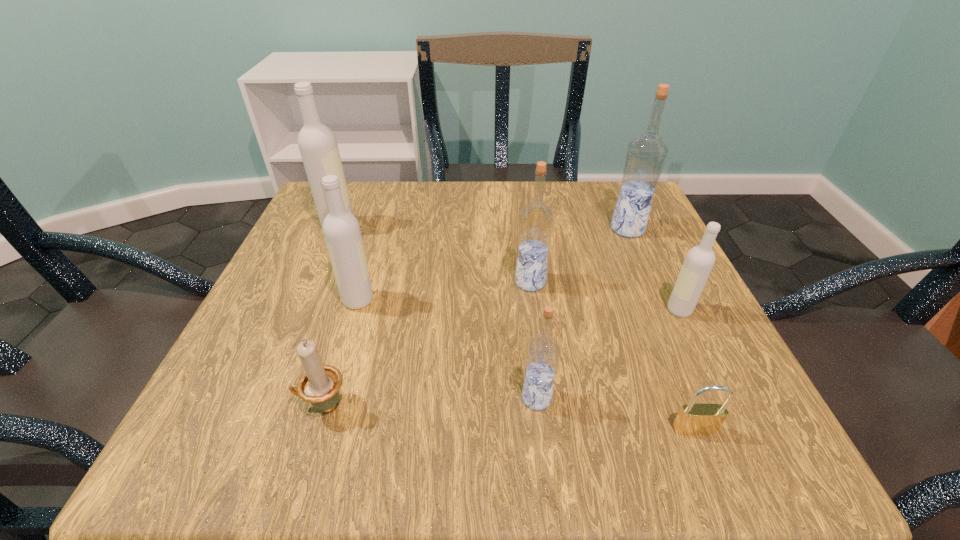
At what (x,y) coordinates should I click in order to perform the action: click on candle_holder. Please return your answer as a coordinate pair (x, y). Looking at the image, I should click on pos(320,384).

Locate an element on the screen. The height and width of the screenshot is (540, 960). brass padlock is located at coordinates (693, 419).

Image resolution: width=960 pixels, height=540 pixels. In order to click on padlock in this screenshot , I will do `click(693, 419)`.

The width and height of the screenshot is (960, 540). I want to click on vacant area located 0.150m on the back of the farthest white vodka, so coord(356,184).

I want to click on free space located on the left of the farthest blue vodka, so [x=508, y=229].

I want to click on vacant area situated 0.210m on the right of the second white vodka from right to left, so click(492, 300).

The height and width of the screenshot is (540, 960). Find the location of `vacant area located 0.110m on the left of the second nearest blue vodka`. vacant area located 0.110m on the left of the second nearest blue vodka is located at coordinates (455, 282).

At what (x,y) coordinates should I click in order to perform the action: click on vacant point located 0.070m on the front of the smallest white vodka. Please return your answer as a coordinate pair (x, y). Image resolution: width=960 pixels, height=540 pixels. Looking at the image, I should click on 699,352.

At what (x,y) coordinates should I click in order to perform the action: click on free space located on the left of the nearest blue vodka. Please return your answer as a coordinate pair (x, y). Looking at the image, I should click on (479, 398).

This screenshot has height=540, width=960. In order to click on free location located on the handle side of the seventh tallest object in this screenshot , I will do `click(248, 406)`.